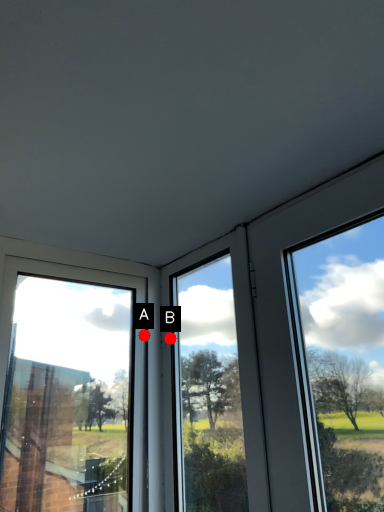
Question: Two points are circled on the image, labeled by A and B beside each circle. Which point is closer to the camera?

Choices:
 (A) A is closer
 (B) B is closer

Answer: (B)